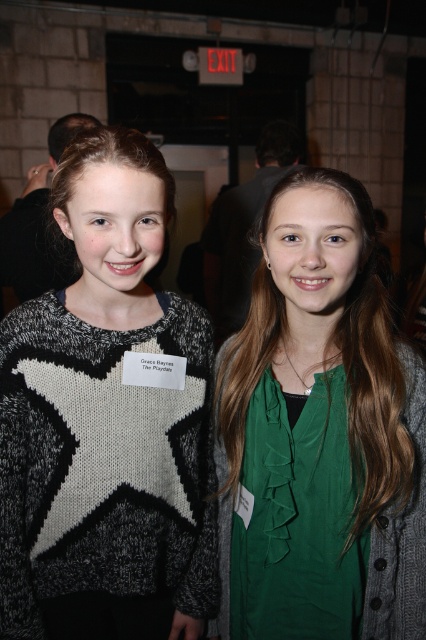
You are at a social event and need to identify which person is taller between the two individuals wearing the knit sweater with star at center and the green fabric shirt at center. Based on the scene description, which one is taller?

The knit sweater with star at center is much taller than the green fabric shirt at center, so the person wearing the knit sweater with star at center is taller.

You are standing in front of the two people in the image. You want to hand a gift to Grace Baynes, who is wearing the knit sweater with star at center. If you reach out your hand, will you be able to touch the sweater?

The knit sweater with star at center is 80.57 centimeters away from the viewer, so you can reach out your hand and touch it since it is within arm length.

You are standing in a social event and want to take a photo of the point at coordinates (138,268). Your camera has a minimum focus distance of 35 inches. Will you need to move closer to focus on that point?

The distance of point (138,268) from viewer is 34.23 inches, which is less than the camera minimum focus distance of 35 inches. Therefore, you need to move back to focus on that point.